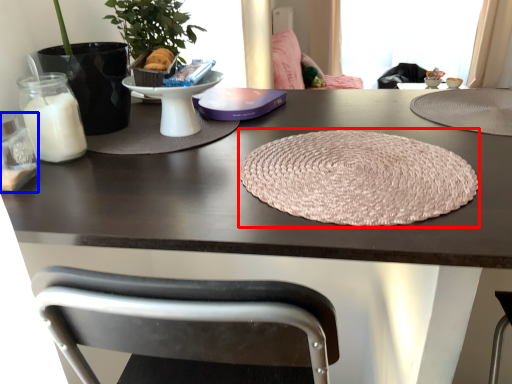
Question: Which object appears farthest to the camera in this image, yoga mat (highlighted by a red box) or candle holder (highlighted by a blue box)?

Choices:
 (A) yoga mat
 (B) candle holder

Answer: (B)